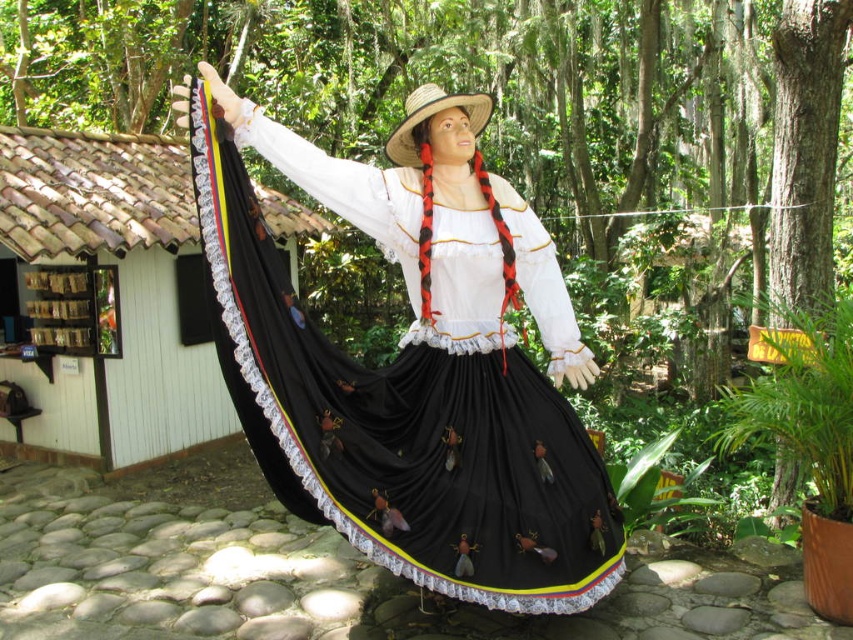
You are a photographer planning to take a photo of the statue. You want to ensure that both the black satin dress at center and the straw hat at center are clearly visible in the frame. Based on their positions, which object should you focus on first to ensure both are in focus?

The black satin dress at center is positioned on the left side of straw hat at center. To ensure both are in focus, you should focus on the black satin dress at center first since it is closer to the left side and adjusting focus from there would capture the straw hat at center as well.

You are a photographer standing at the camera position. You want to take a closeup of the black satin dress at center. Considering your current distance, do you need to move closer or farther away to achieve this?

The black satin dress at center is 3.01 meters away from the camera. To take a closeup, you need to move closer to reduce the distance between the camera and the dress.